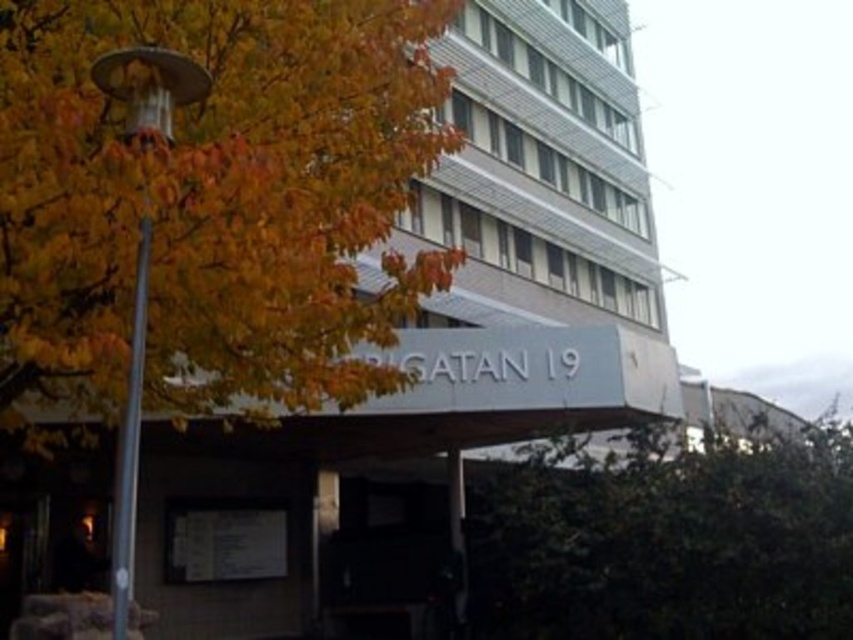
Does yellow leafy tree at left have a greater height compared to green leafy tree at center?

Yes.

Can you confirm if yellow leafy tree at left is thinner than green leafy tree at center?

Yes.

Looking at this image, who is more distant from viewer, (247, 248) or (531, 525)?

Point (531, 525)

Locate an element on the screen. The width and height of the screenshot is (853, 640). yellow leafy tree at left is located at coordinates (206, 208).

Measure the distance between yellow leafy tree at left and metallic pole at left.

yellow leafy tree at left is 1.40 meters from metallic pole at left.

Is yellow leafy tree at left to the left of metallic pole at left from the viewer's perspective?

Incorrect, yellow leafy tree at left is not on the left side of metallic pole at left.

Between point (80, 349) and point (109, 52), which one is positioned in front?

Point (109, 52) is more forward.

Identify the location of yellow leafy tree at left. Image resolution: width=853 pixels, height=640 pixels. coord(206,208).

Is point (787, 541) farther from viewer compared to point (181, 60)?

Yes, point (787, 541) is behind point (181, 60).

Can you confirm if green leafy tree at center is positioned to the right of metallic pole at left?

Yes, green leafy tree at center is to the right of metallic pole at left.

I want to click on green leafy tree at center, so click(668, 540).